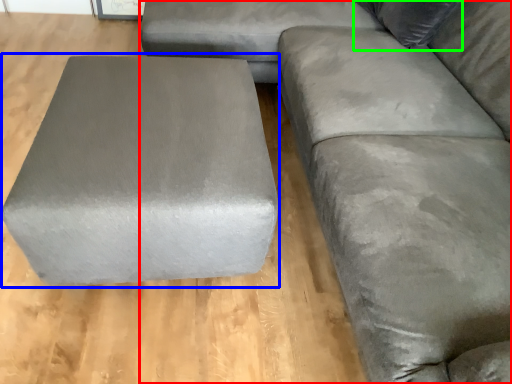
Question: Which object is the farthest from studio couch (highlighted by a red box)? Choose among these: stool (highlighted by a blue box) or pillow (highlighted by a green box).

Choices:
 (A) stool
 (B) pillow

Answer: (A)